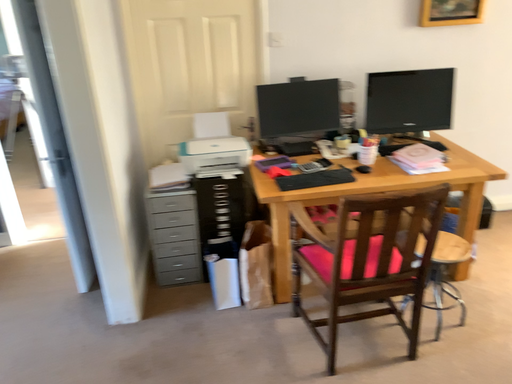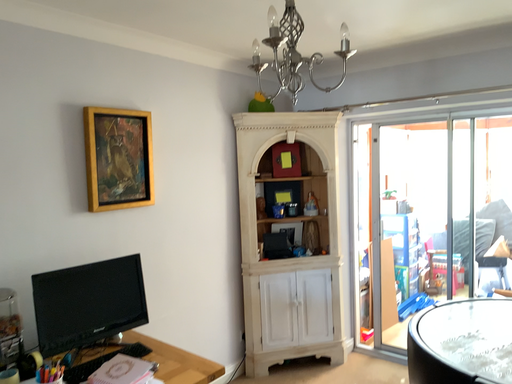
Question: Which way did the camera rotate in the video?

Choices:
 (A) rotated downward
 (B) rotated upward

Answer: (B)